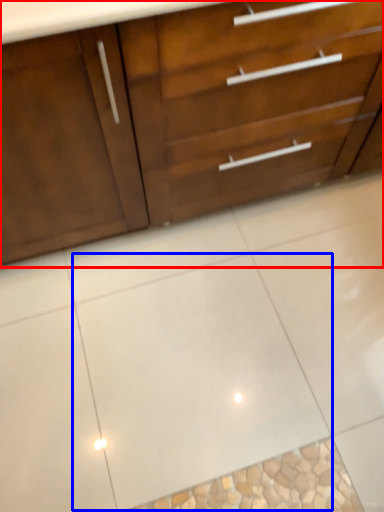
Question: Which point is closer to the camera, chest of drawers (highlighted by a red box) or ceramic tile (highlighted by a blue box)?

Choices:
 (A) chest of drawers
 (B) ceramic tile

Answer: (A)